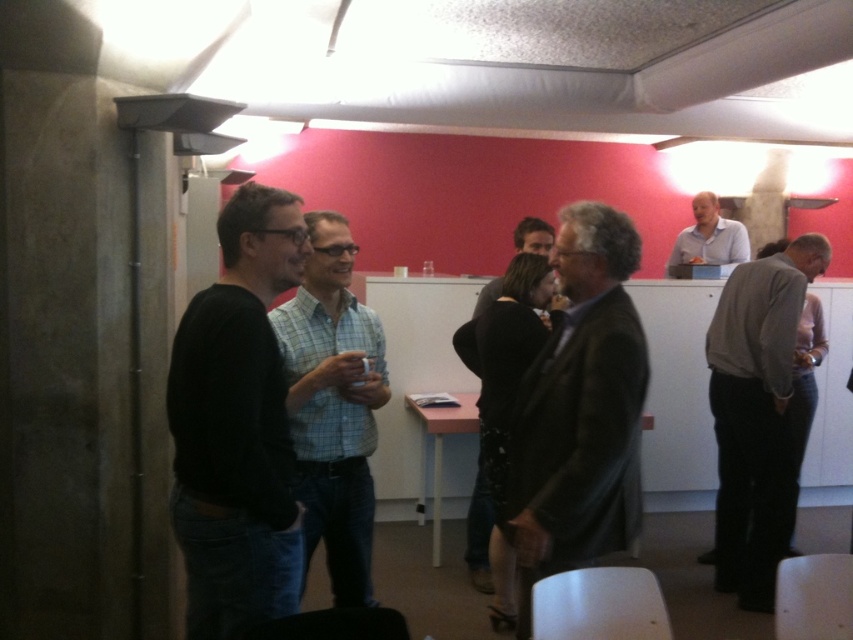
You are standing in the room and want to find the gray wool sweater at right. Based on the coordinates provided, where should you look relative to the room?

The gray wool sweater at right is located at coordinates point (x=756, y=413), which is in the lower right area of the room.

You are organizing a clothing donation drive and need to determine which of the two items, the light blue checkered shirt at center or the dark gray leather jacket at center, can fit into a donation box that has a width capacity of 40 cm. Based on their sizes, which item is more likely to fit?

The light blue checkered shirt at center has a smaller width than the dark gray leather jacket at center. Since the donation box can only hold items up to 40 cm in width, the light blue checkered shirt at center is more likely to fit inside the box.